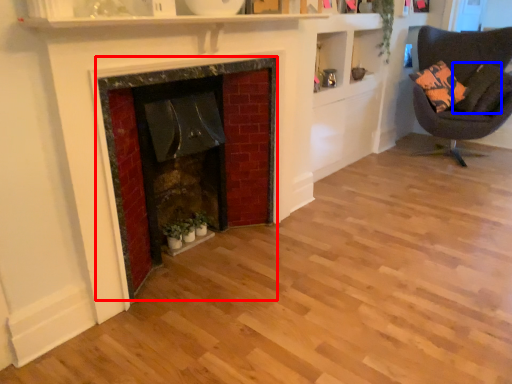
Question: Which point is further to the camera, fireplace (highlighted by a red box) or pillow (highlighted by a blue box)?

Choices:
 (A) fireplace
 (B) pillow

Answer: (B)